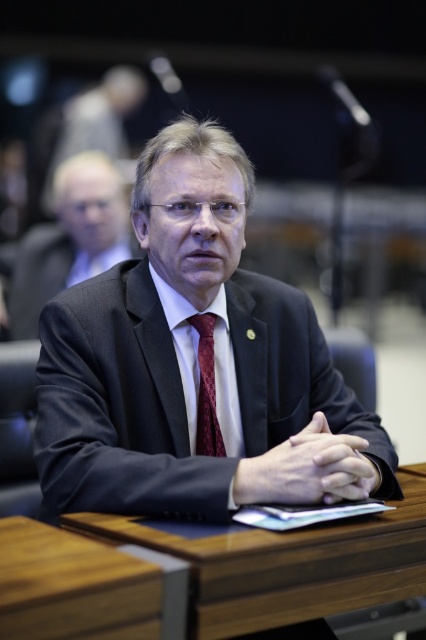
Question: Does dark blue suit at center have a smaller size compared to burgundy woven tie at center?

Choices:
 (A) no
 (B) yes

Answer: (A)

Question: Can you confirm if wooden table at center is wider than matte black suit at center?

Choices:
 (A) no
 (B) yes

Answer: (B)

Question: Which point is closer to the camera?

Choices:
 (A) wooden table at center
 (B) dark blue suit at center
 (C) matte black suit at center
 (D) burgundy woven tie at center

Answer: (A)

Question: Among these objects, which one is farthest from the camera?

Choices:
 (A) dark blue suit at center
 (B) wooden table at center
 (C) burgundy woven tie at center
 (D) matte black suit at center

Answer: (D)

Question: Is dark blue suit at center bigger than burgundy woven tie at center?

Choices:
 (A) yes
 (B) no

Answer: (A)

Question: Which object is positioned farthest from the burgundy woven tie at center?

Choices:
 (A) wooden table at center
 (B) matte black suit at center

Answer: (B)